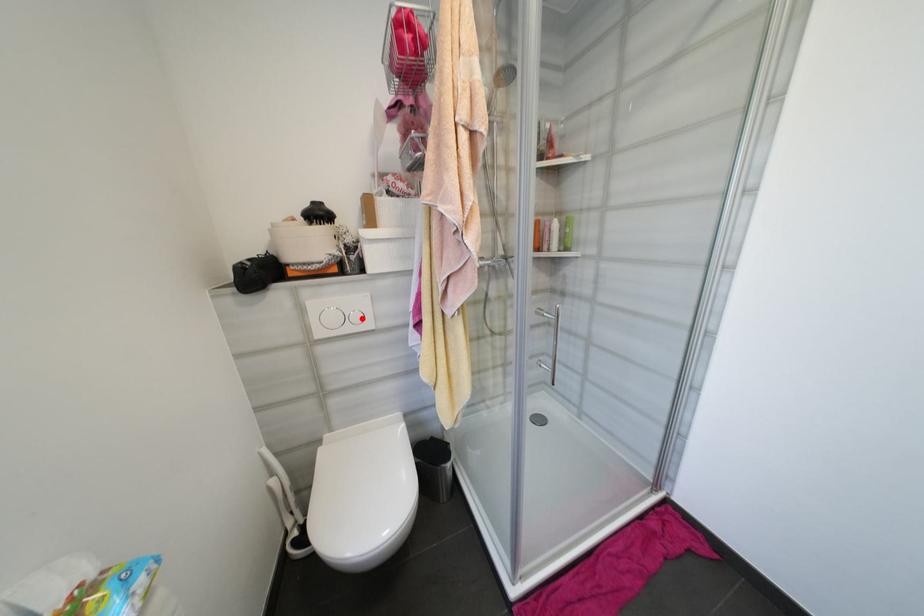
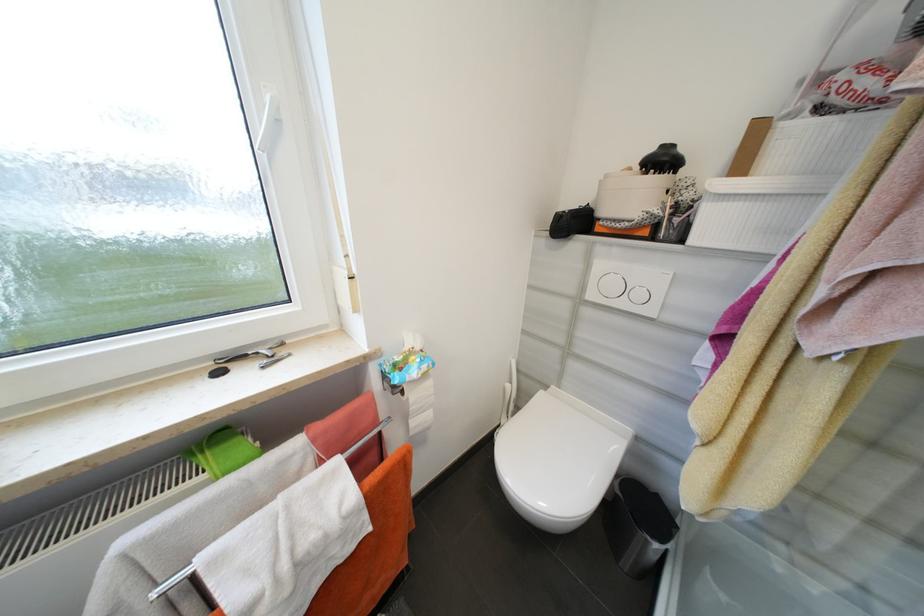
Locate, in the second image, the point that corresponds to the highlighted location in the first image.

(646, 296)